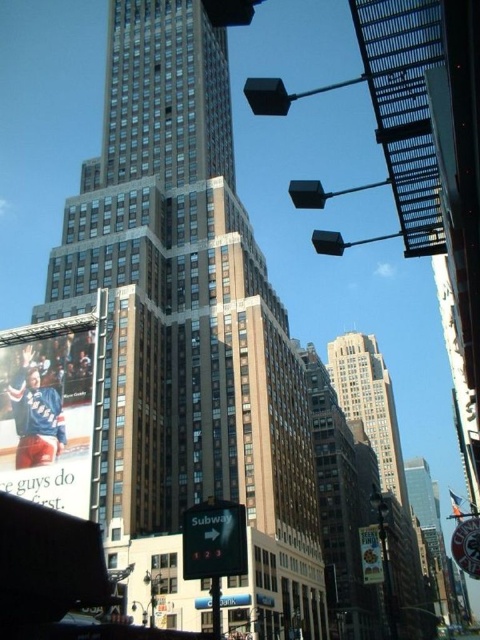
Can you confirm if white glossy hockey player at lower left is positioned to the right of white glossy billboard at center?

In fact, white glossy hockey player at lower left is to the left of white glossy billboard at center.

Who is positioned more to the left, white glossy hockey player at lower left or white glossy billboard at center?

white glossy hockey player at lower left is more to the left.

At what (x,y) coordinates should I click in order to perform the action: click on white glossy hockey player at lower left. Please return your answer as a coordinate pair (x, y). Looking at the image, I should click on (48, 417).

Is green matte sign at lower center taller than metallic pole at lower center?

No, green matte sign at lower center is not taller than metallic pole at lower center.

From the picture: Can you confirm if green matte sign at lower center is bigger than metallic pole at lower center?

Yes, green matte sign at lower center is bigger than metallic pole at lower center.

The image size is (480, 640). What do you see at coordinates (214, 540) in the screenshot?
I see `green matte sign at lower center` at bounding box center [214, 540].

Where is `green matte sign at lower center`? This screenshot has width=480, height=640. green matte sign at lower center is located at coordinates (214, 540).

Does green matte sign at lower center appear on the right side of metallic silver sign at lower right?

Incorrect, green matte sign at lower center is not on the right side of metallic silver sign at lower right.

Between green matte sign at lower center and metallic silver sign at lower right, which one appears on the left side from the viewer's perspective?

green matte sign at lower center is more to the left.

Is point (233, 556) behind point (452, 536)?

No, (233, 556) is closer to viewer.

Find the location of `green matte sign at lower center`. green matte sign at lower center is located at coordinates (214, 540).